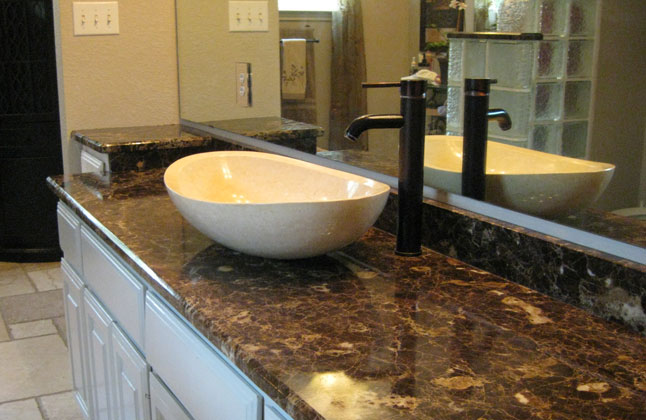
Image resolution: width=646 pixels, height=420 pixels. Find the location of `faucet`. faucet is located at coordinates (373, 121).